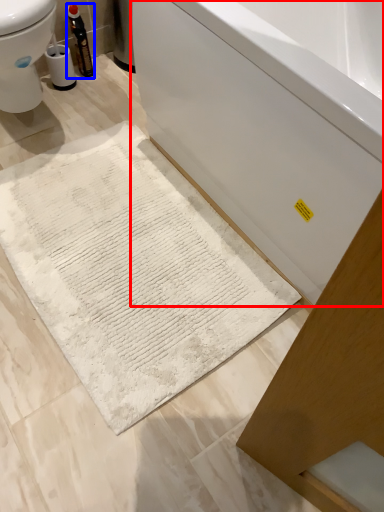
Question: Which of the following is the closest to the observer, bathtub (highlighted by a red box) or bottle (highlighted by a blue box)?

Choices:
 (A) bathtub
 (B) bottle

Answer: (A)